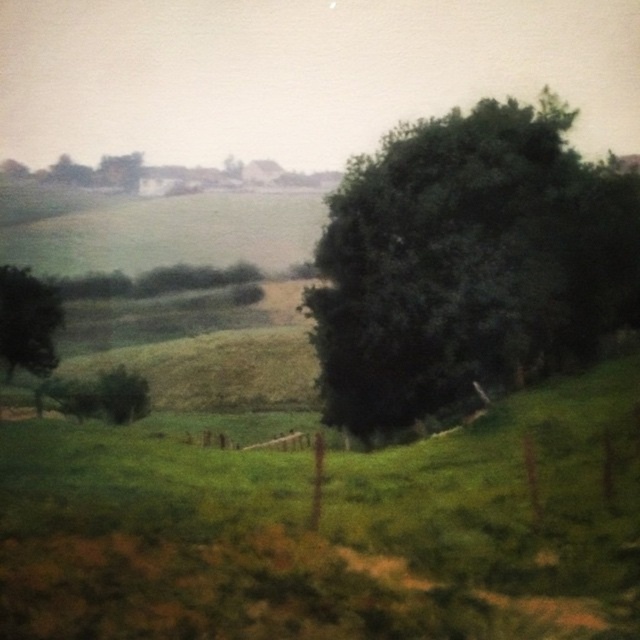
Question: Which point is closer to the camera taking this photo?

Choices:
 (A) (368, 179)
 (B) (28, 292)

Answer: (A)

Question: Observing the image, what is the correct spatial positioning of green leafy tree at right in reference to green matte tree at left?

Choices:
 (A) above
 (B) below

Answer: (A)

Question: Does green leafy tree at right appear under green matte tree at left?

Choices:
 (A) yes
 (B) no

Answer: (B)

Question: Does green leafy tree at right come in front of green matte tree at left?

Choices:
 (A) yes
 (B) no

Answer: (A)

Question: Among these objects, which one is farthest from the camera?

Choices:
 (A) green leafy tree at right
 (B) green matte tree at left

Answer: (B)